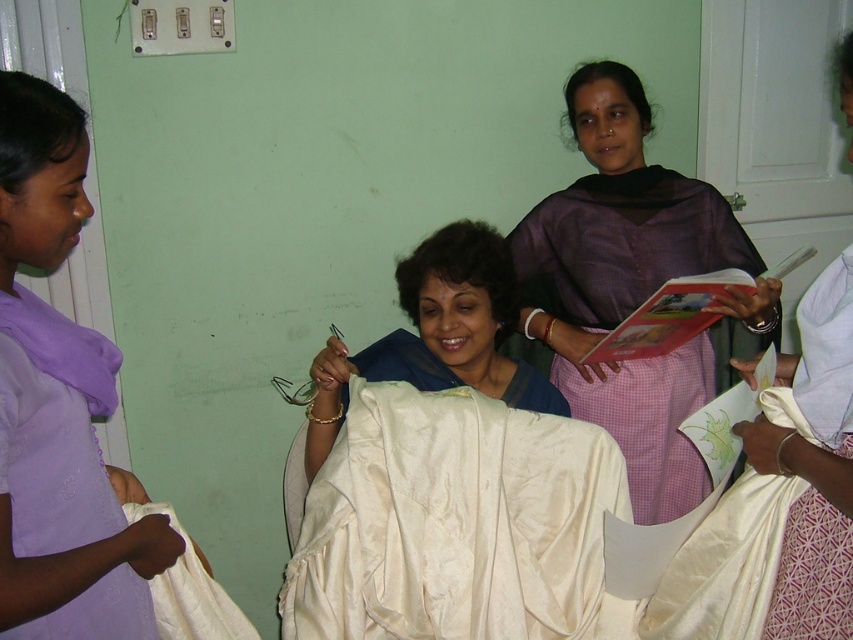
You are a fashion designer observing the scene. You need to determine which item is more to the left between the purple satin scarf at left and the satin white saree at center. Which one is it?

The purple satin scarf at left is positioned on the left side of the satin white saree at center, so the purple satin scarf at left is more to the left.

Based on the description, can you determine the exact coordinates of the white silk cloth at center in the image?

The white silk cloth at center is located at coordinates point (456, 524).

Where is the purple satin scarf at left located in the image?

The purple satin scarf at left is located at point 0.889 on the horizontal axis and 0.093 on the vertical axis.